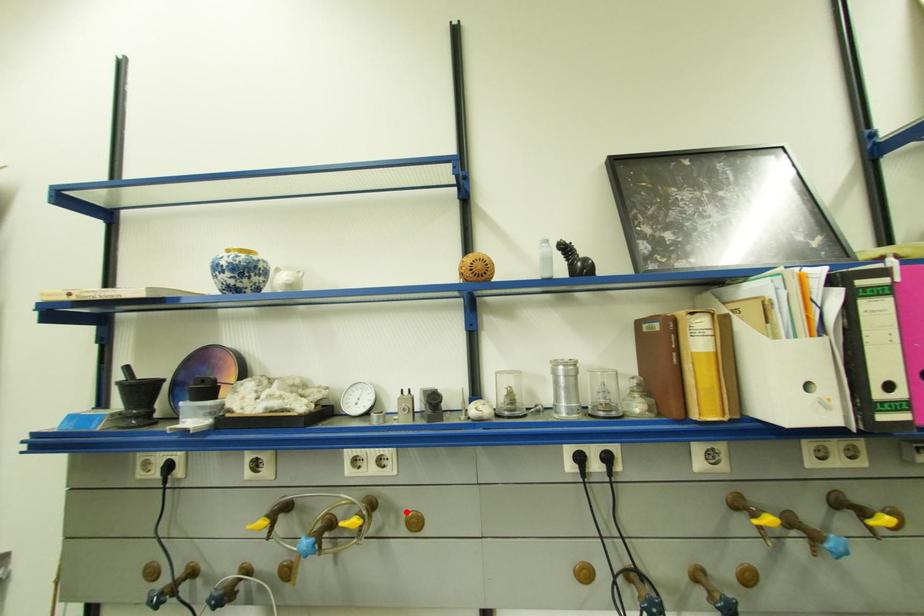
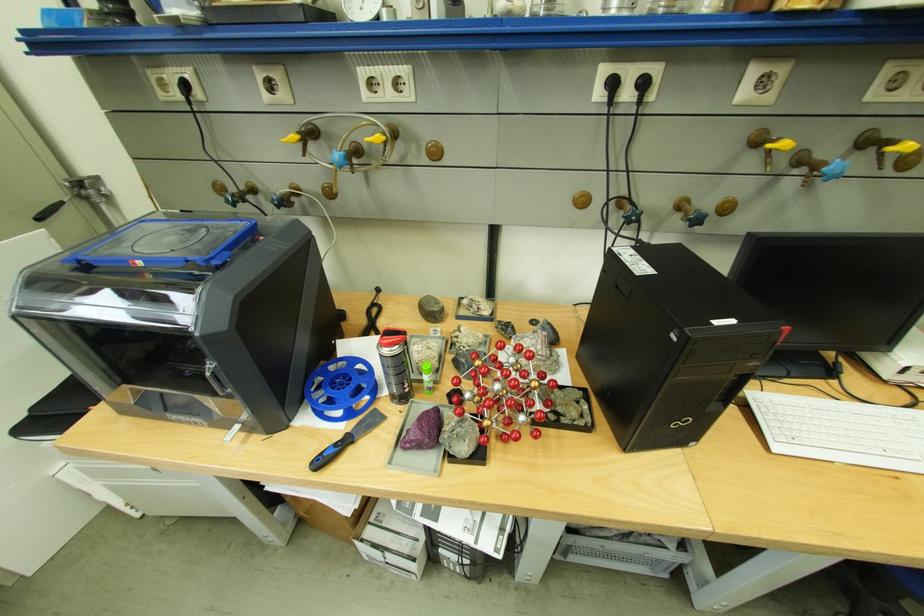
Locate, in the second image, the point that corresponds to the highlighted location in the first image.

(428, 140)